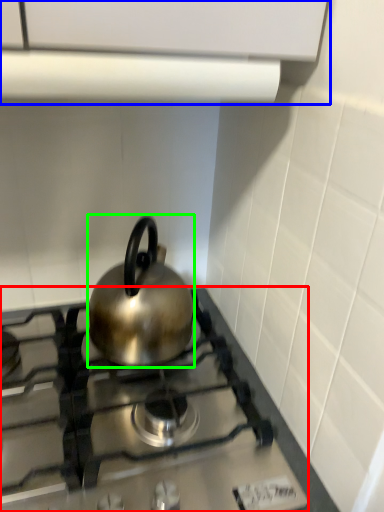
Question: Based on their relative distances, which object is farther from gas stove (highlighted by a red box)? Choose from vent (highlighted by a blue box) and kettle (highlighted by a green box).

Choices:
 (A) vent
 (B) kettle

Answer: (A)